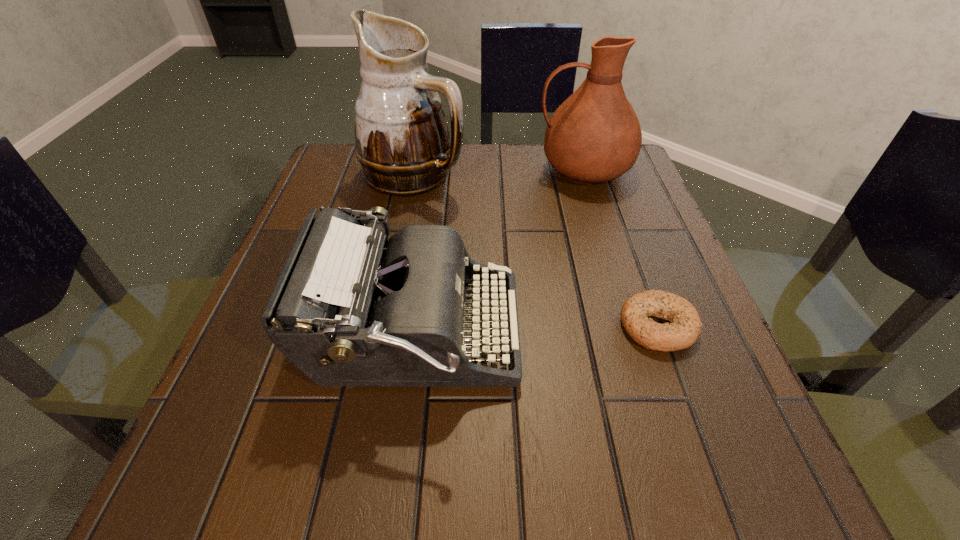
Find the location of a particular element. pitcher that is at the left edge is located at coordinates (402, 141).

Image resolution: width=960 pixels, height=540 pixels. What are the coordinates of `typewriter that is at the left edge` in the screenshot? It's located at (346, 312).

Identify the location of pitcher situated at the right edge. (594, 136).

Locate an element on the screen. bagel that is at the right edge is located at coordinates (684, 329).

This screenshot has width=960, height=540. I want to click on object that is at the far left corner, so click(402, 141).

At what (x,y) coordinates should I click in order to perform the action: click on object located at the far right corner. Please return your answer as a coordinate pair (x, y). The image size is (960, 540). Looking at the image, I should click on (594, 136).

Where is `vacant point at the far edge`? The height and width of the screenshot is (540, 960). vacant point at the far edge is located at coordinates (470, 188).

Locate an element on the screen. vacant area at the left edge is located at coordinates (248, 366).

In the image, there is a desktop. Where is `vacant space at the right edge`? vacant space at the right edge is located at coordinates (652, 426).

Find the location of a particular element. This screenshot has width=960, height=540. vacant space at the near left corner of the desktop is located at coordinates (223, 516).